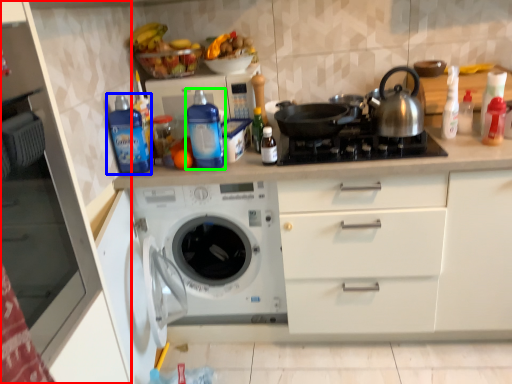
Question: Estimate the real-world distances between objects in this image. Which object is closer to cabinetry (highlighted by a red box), bottle (highlighted by a blue box) or bottle (highlighted by a green box)?

Choices:
 (A) bottle
 (B) bottle

Answer: (A)